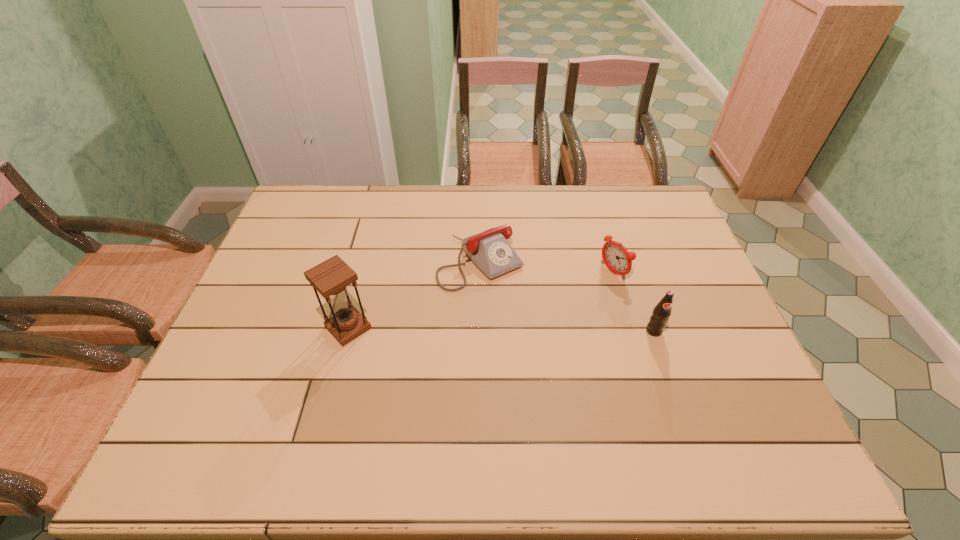
Find the location of a particular element. This screenshot has height=540, width=960. the leftmost object is located at coordinates (330, 278).

This screenshot has height=540, width=960. In order to click on the tallest object in this screenshot , I will do `click(330, 278)`.

Identify the location of the rightmost object. (662, 311).

Where is `pop`? The height and width of the screenshot is (540, 960). pop is located at coordinates (662, 311).

The height and width of the screenshot is (540, 960). In order to click on the second object from right to left in this screenshot , I will do `click(616, 257)`.

At what (x,y) coordinates should I click in order to perform the action: click on the third tallest object. Please return your answer as a coordinate pair (x, y). Looking at the image, I should click on (616, 257).

Image resolution: width=960 pixels, height=540 pixels. I want to click on the shortest object, so click(x=490, y=251).

At what (x,y) coordinates should I click in order to perform the action: click on the third object from right to left. Please return your answer as a coordinate pair (x, y). Looking at the image, I should click on (490, 251).

Identify the location of free space located 0.100m on the right of the tallest object. This screenshot has width=960, height=540. (409, 328).

What are the coordinates of `vacant space located on the front label of the rightmost object` in the screenshot? It's located at (663, 360).